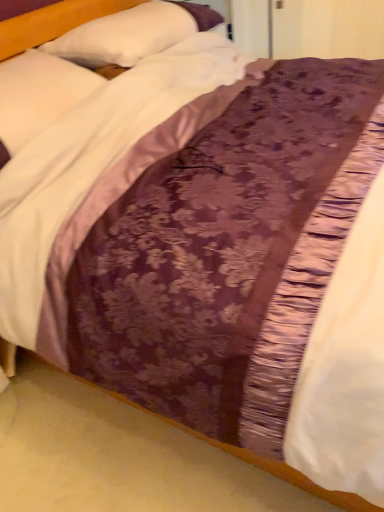
Question: Does white satin pillow at upper center, placed as the first pillow when sorted from top to bottom, turn towards white satin pillow at upper left, which is counted as the 1th pillow, starting from the bottom?

Choices:
 (A) yes
 (B) no

Answer: (B)

Question: Can you confirm if white satin pillow at upper center, the second pillow ordered from the bottom, is taller than white satin pillow at upper left, which is the 2th pillow from top to bottom?

Choices:
 (A) yes
 (B) no

Answer: (B)

Question: Is white satin pillow at upper center, the second pillow ordered from the bottom, positioned beyond the bounds of white satin pillow at upper left, which is counted as the 1th pillow, starting from the bottom?

Choices:
 (A) yes
 (B) no

Answer: (A)

Question: Does white satin pillow at upper center, the second pillow ordered from the bottom, lie in front of white satin pillow at upper left, which is the 2th pillow from top to bottom?

Choices:
 (A) yes
 (B) no

Answer: (B)

Question: Is white satin pillow at upper center, placed as the first pillow when sorted from top to bottom, at the right side of white satin pillow at upper left, which is counted as the 1th pillow, starting from the bottom?

Choices:
 (A) no
 (B) yes

Answer: (B)

Question: Is white satin pillow at upper center, placed as the first pillow when sorted from top to bottom, touching white satin pillow at upper left, which is counted as the 1th pillow, starting from the bottom?

Choices:
 (A) yes
 (B) no

Answer: (B)

Question: Is white satin pillow at upper left, which is counted as the 1th pillow, starting from the bottom, turned away from white satin pillow at upper center, the second pillow ordered from the bottom?

Choices:
 (A) yes
 (B) no

Answer: (B)

Question: Are white satin pillow at upper left, which is the 2th pillow from top to bottom, and white satin pillow at upper center, placed as the first pillow when sorted from top to bottom, located far from each other?

Choices:
 (A) no
 (B) yes

Answer: (A)

Question: From the image's perspective, is white satin pillow at upper left, which is counted as the 1th pillow, starting from the bottom, under white satin pillow at upper center, the second pillow ordered from the bottom?

Choices:
 (A) no
 (B) yes

Answer: (B)

Question: Is white satin pillow at upper left, which is counted as the 1th pillow, starting from the bottom, to the right of white satin pillow at upper center, the second pillow ordered from the bottom, from the viewer's perspective?

Choices:
 (A) yes
 (B) no

Answer: (B)

Question: Is white satin pillow at upper left, which is counted as the 1th pillow, starting from the bottom, shorter than white satin pillow at upper center, the second pillow ordered from the bottom?

Choices:
 (A) no
 (B) yes

Answer: (A)

Question: Considering the relative sizes of white satin pillow at upper left, which is the 2th pillow from top to bottom, and white satin pillow at upper center, the second pillow ordered from the bottom, in the image provided, is white satin pillow at upper left, which is the 2th pillow from top to bottom, wider than white satin pillow at upper center, the second pillow ordered from the bottom,?

Choices:
 (A) no
 (B) yes

Answer: (B)

Question: Choose the correct answer: Is white satin pillow at upper left, which is the 2th pillow from top to bottom, inside white satin pillow at upper center, the second pillow ordered from the bottom, or outside it?

Choices:
 (A) outside
 (B) inside

Answer: (A)